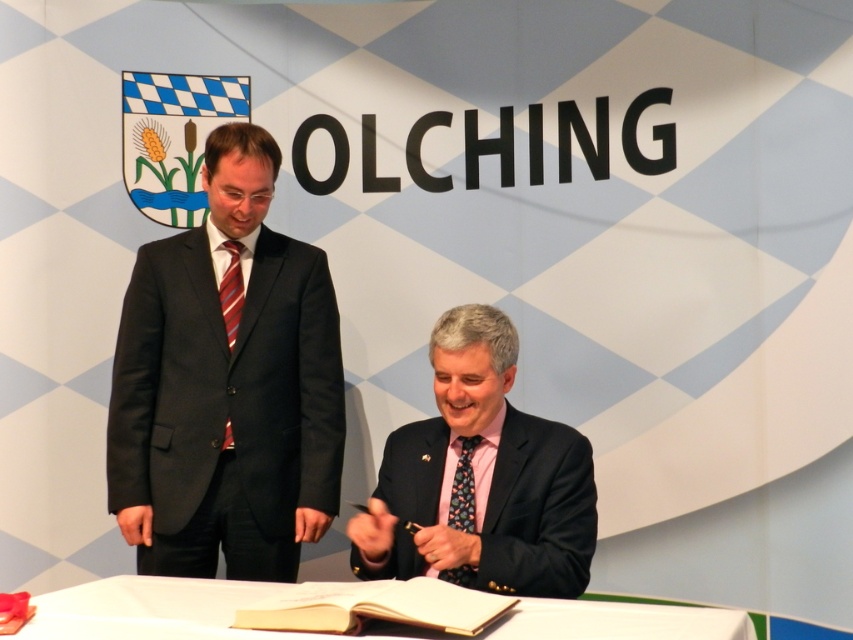
Question: Which point appears farthest from the camera in this image?

Choices:
 (A) (228, 428)
 (B) (456, 518)
 (C) (97, 605)
 (D) (293, 292)

Answer: (D)

Question: Is matte black suit at left smaller than striped silk tie at left?

Choices:
 (A) no
 (B) yes

Answer: (A)

Question: Which point appears farthest from the camera in this image?

Choices:
 (A) (196, 616)
 (B) (431, 476)
 (C) (218, 435)
 (D) (461, 524)

Answer: (C)

Question: Is pink silk tie at center to the right of floral silk tie at lower center from the viewer's perspective?

Choices:
 (A) no
 (B) yes

Answer: (B)

Question: Is matte black suit at left thinner than pink silk tie at center?

Choices:
 (A) no
 (B) yes

Answer: (A)

Question: Which object is positioned farthest from the striped silk tie at left?

Choices:
 (A) white paper at lower center
 (B) pink silk tie at center
 (C) matte black suit at left
 (D) floral silk tie at lower center

Answer: (A)